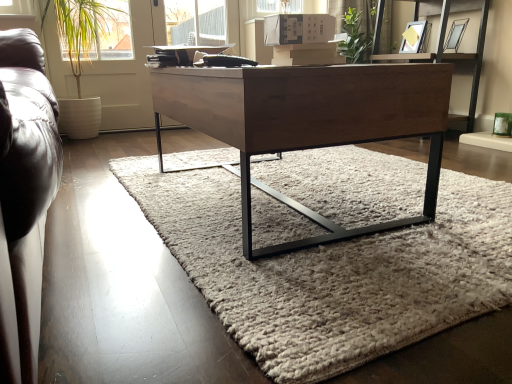
Locate an element on the screen. vacant area that is in front of wooden desk at center is located at coordinates (324, 274).